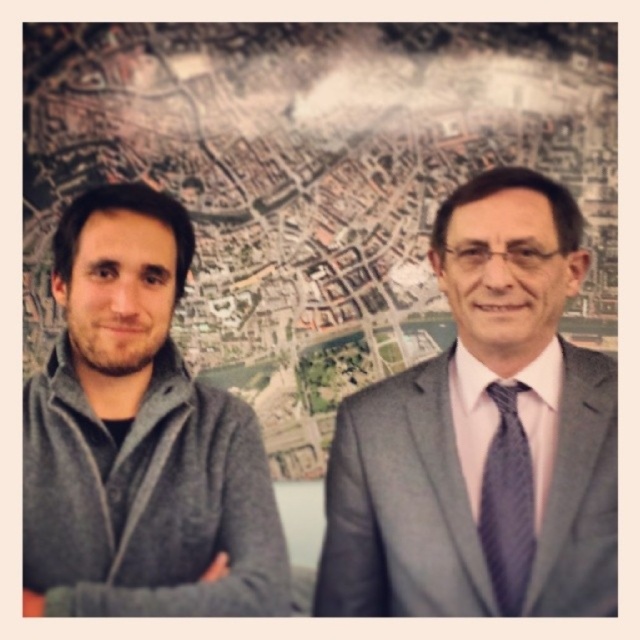
Question: Is gray fleece jacket at left closer to camera compared to dark gray textured tie at right?

Choices:
 (A) no
 (B) yes

Answer: (B)

Question: Which of the following is the farthest from the observer?

Choices:
 (A) (540, 314)
 (B) (516, 588)
 (C) (115, 259)

Answer: (A)

Question: Which object appears closest to the camera in this image?

Choices:
 (A) gray fleece jacket at left
 (B) matte gray suit at right
 (C) dark gray textured tie at right

Answer: (A)

Question: Can you confirm if gray fleece jacket at left is positioned above dark gray textured tie at right?

Choices:
 (A) no
 (B) yes

Answer: (B)

Question: Which point appears closest to the camera in this image?

Choices:
 (A) (547, 577)
 (B) (234, 515)
 (C) (520, 445)

Answer: (A)

Question: Is matte gray suit at right closer to camera compared to dark gray textured tie at right?

Choices:
 (A) no
 (B) yes

Answer: (B)